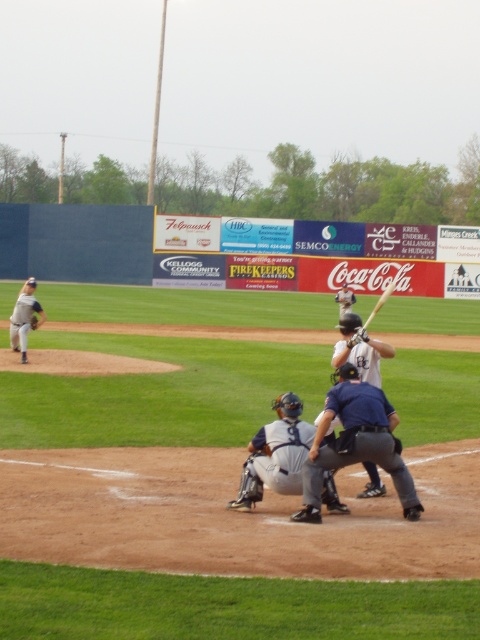
Is dark blue uniform at center to the left of gray matte uniform at center from the viewer's perspective?

Incorrect, dark blue uniform at center is not on the left side of gray matte uniform at center.

Which is behind, point (362, 404) or point (280, 452)?

Positioned behind is point (280, 452).

Describe the element at coordinates (356, 444) in the screenshot. This screenshot has height=640, width=480. I see `dark blue uniform at center` at that location.

Find the location of a particular element. dark blue uniform at center is located at coordinates (356, 444).

Who is positioned more to the left, gray uniformed pitcher at left or brown leather glove at lower center?

Positioned to the left is gray uniformed pitcher at left.

Between point (24, 353) and point (347, 342), which one is positioned behind?

The point (24, 353) is behind.

Image resolution: width=480 pixels, height=640 pixels. Identify the location of gray uniformed pitcher at left. (24, 317).

Is gray matte uniform at center bigger than brown leather glove at left?

Yes, gray matte uniform at center is bigger than brown leather glove at left.

Find the location of `gray matte uniform at center`. gray matte uniform at center is located at coordinates (276, 454).

Between point (286, 465) and point (36, 317), which one is positioned behind?

Positioned behind is point (36, 317).

I want to click on gray matte uniform at center, so click(x=276, y=454).